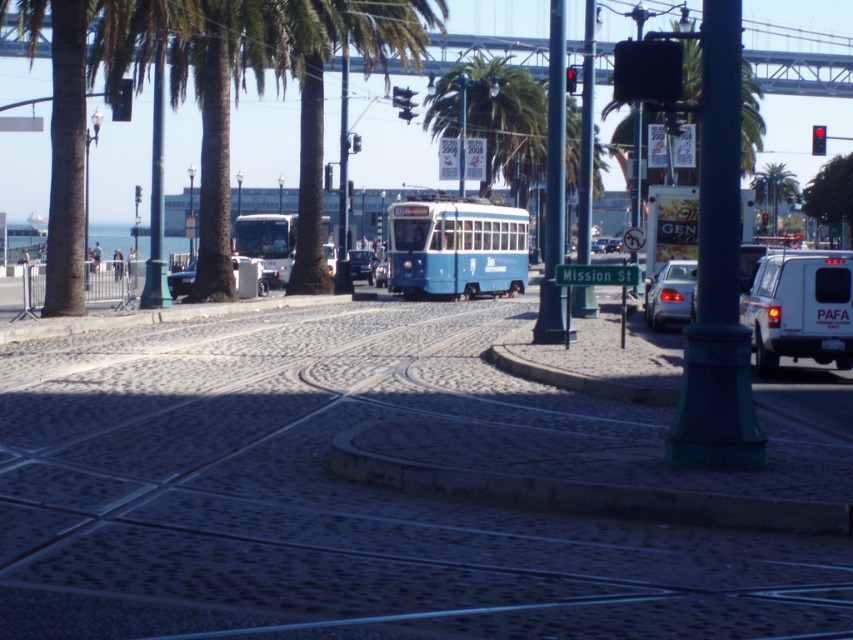
Is point (683, 316) positioned behind point (766, 205)?

No, (683, 316) is in front of (766, 205).

Who is positioned more to the left, satin silver sedan at center or green leafy palm tree at upper center?

satin silver sedan at center

Is point (669, 285) positioned after point (758, 230)?

No, it is in front of (758, 230).

In order to click on satin silver sedan at center in this screenshot , I will do `click(669, 294)`.

Who is positioned more to the left, metallic traffic light at upper left or metallic silver sedan at center?

Positioned to the left is metallic traffic light at upper left.

Is metallic traffic light at upper left shorter than metallic silver sedan at center?

No, metallic traffic light at upper left is not shorter than metallic silver sedan at center.

Where is `metallic traffic light at upper left`? The width and height of the screenshot is (853, 640). metallic traffic light at upper left is located at coordinates (123, 100).

How distant is metallic silver sedan at center from red glass traffic light at upper center?

metallic silver sedan at center and red glass traffic light at upper center are 35.83 meters apart.

Can you confirm if metallic silver sedan at center is shorter than red glass traffic light at upper center?

No.

Is point (378, 262) positioned after point (575, 86)?

Yes.

Where is `metallic silver sedan at center`? metallic silver sedan at center is located at coordinates (381, 273).